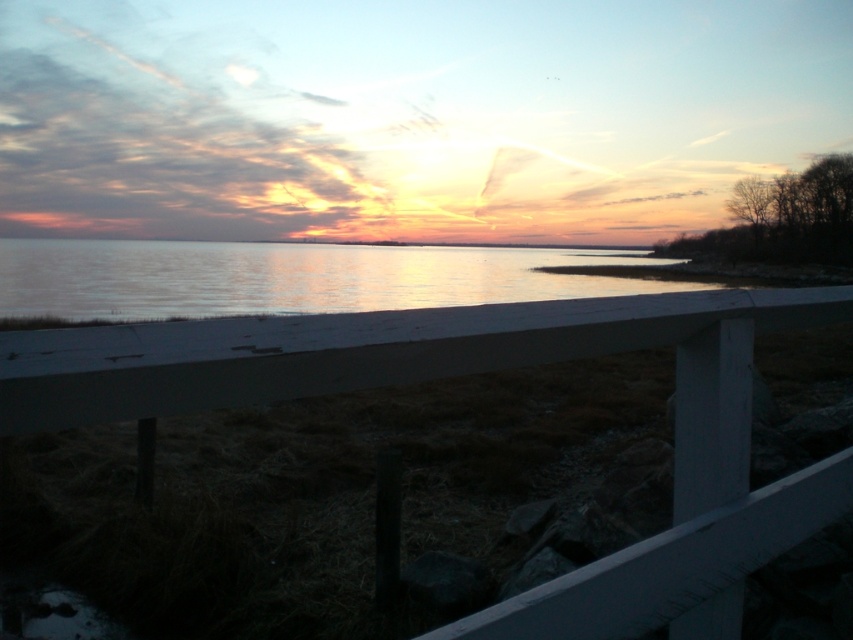
Question: Which point is farther from the camera taking this photo?

Choices:
 (A) (427, 353)
 (B) (90, 269)

Answer: (B)

Question: Does white painted wood rail at upper center have a lesser width compared to smooth water at center?

Choices:
 (A) yes
 (B) no

Answer: (A)

Question: Does white painted wood rail at upper center appear on the left side of smooth water at center?

Choices:
 (A) yes
 (B) no

Answer: (B)

Question: Which of the following is the farthest from the observer?

Choices:
 (A) white painted wood rail at upper center
 (B) smooth water at center

Answer: (B)

Question: Which of the following is the closest to the observer?

Choices:
 (A) [x=76, y=300]
 (B) [x=410, y=323]

Answer: (B)

Question: Can you confirm if white painted wood rail at upper center is bigger than smooth water at center?

Choices:
 (A) yes
 (B) no

Answer: (B)